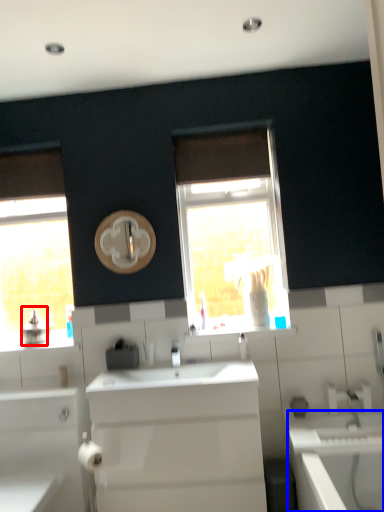
Question: Which of the following is the closest to the observer, appliance (highlighted by a red box) or bath (highlighted by a blue box)?

Choices:
 (A) appliance
 (B) bath

Answer: (B)